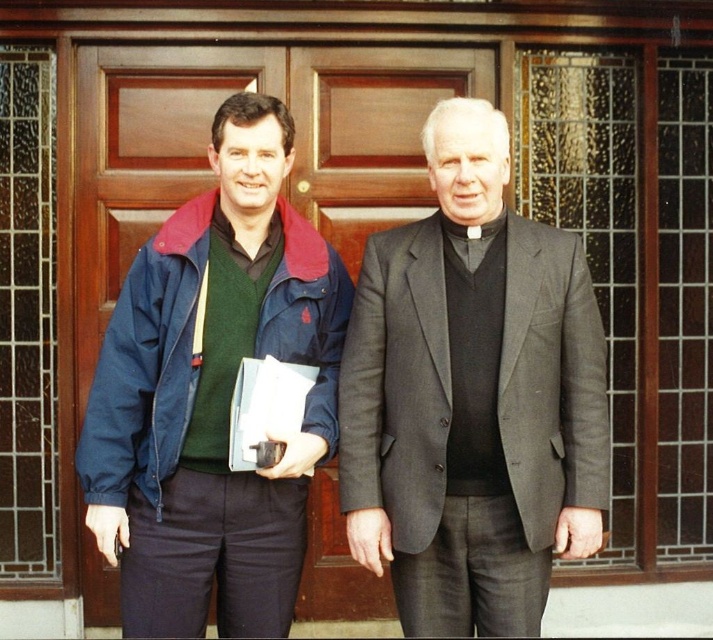
Question: Among these objects, which one is nearest to the camera?

Choices:
 (A) navy blue jacket at left
 (B) brown wooden door at center
 (C) dark gray suit at center
 (D) brown wooden door at left

Answer: (A)

Question: Estimate the real-world distances between objects in this image. Which object is closer to the brown wooden door at center?

Choices:
 (A) brown wooden door at left
 (B) dark gray suit at center

Answer: (A)

Question: Can you confirm if navy blue jacket at left is positioned to the left of dark gray suit at center?

Choices:
 (A) no
 (B) yes

Answer: (B)

Question: Among these points, which one is nearest to the camera?

Choices:
 (A) (420, 618)
 (B) (421, 93)
 (C) (82, 545)

Answer: (A)

Question: Does brown wooden door at center have a greater width compared to brown wooden door at left?

Choices:
 (A) no
 (B) yes

Answer: (B)

Question: Does navy blue jacket at left appear on the left side of dark gray suit at center?

Choices:
 (A) no
 (B) yes

Answer: (B)